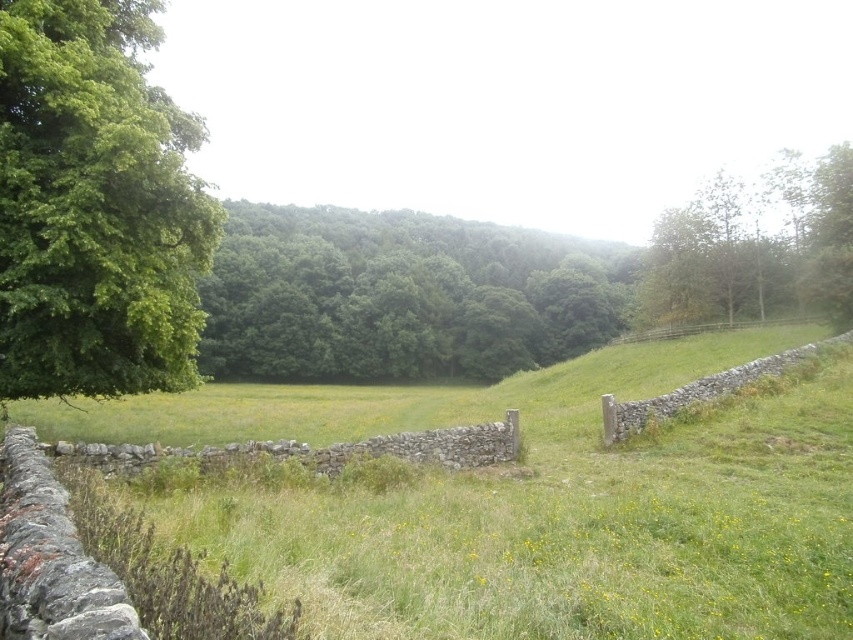
You are standing at the point marked by coordinates point (401,296) in the image. What do you see around you?

You are standing at point (401,296), which marks green leafy trees at center.

You are standing in the field and want to walk towards the dry stone wall at center. Which direction should you walk to avoid the green leafy tree at upper right?

To avoid the green leafy tree at upper right, you should walk to the left of the dry stone wall at center since the tree is positioned to the right of it.

You are standing in the middle of the grassy field and want to walk towards the brown wooden fence at right. Which direction should you walk to avoid the green leafy trees at center?

The green leafy trees at center are located above the brown wooden fence at right, so you should walk to the right side of the trees to avoid them and reach the fence.